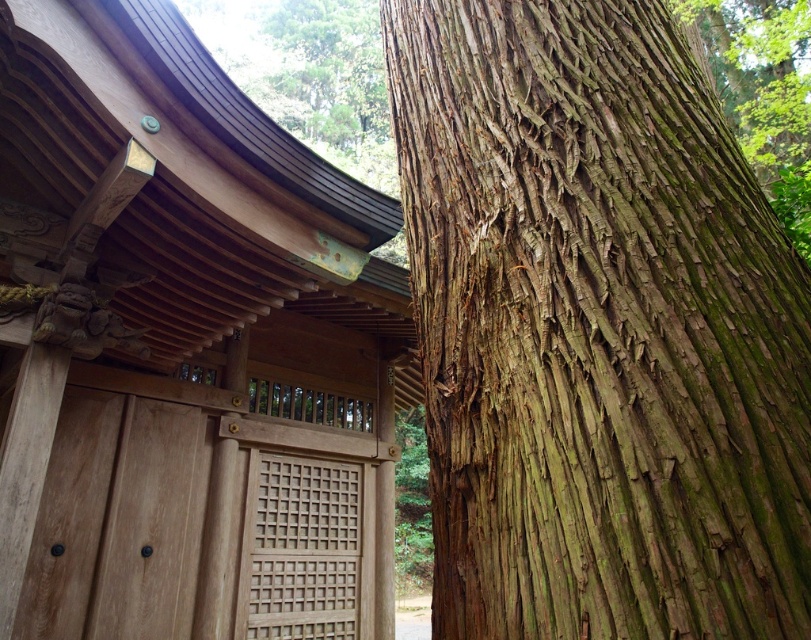
Question: Is greenish-brown bark tree trunk at right closer to the viewer compared to wooden lattice door at center?

Choices:
 (A) yes
 (B) no

Answer: (A)

Question: Which object appears closest to the camera in this image?

Choices:
 (A) greenish-brown bark tree trunk at right
 (B) wooden lattice door at center

Answer: (A)

Question: Among these objects, which one is nearest to the camera?

Choices:
 (A) wooden lattice door at center
 (B) green rough bark tree at upper center
 (C) wooden at left

Answer: (C)

Question: Which is farther from the wooden lattice door at center?

Choices:
 (A) greenish-brown bark tree trunk at right
 (B) wooden at left

Answer: (A)

Question: Considering the relative positions of wooden at left and wooden lattice door at center in the image provided, where is wooden at left located with respect to wooden lattice door at center?

Choices:
 (A) left
 (B) right

Answer: (A)

Question: Does greenish-brown bark tree trunk at right have a lesser width compared to wooden lattice door at center?

Choices:
 (A) yes
 (B) no

Answer: (B)